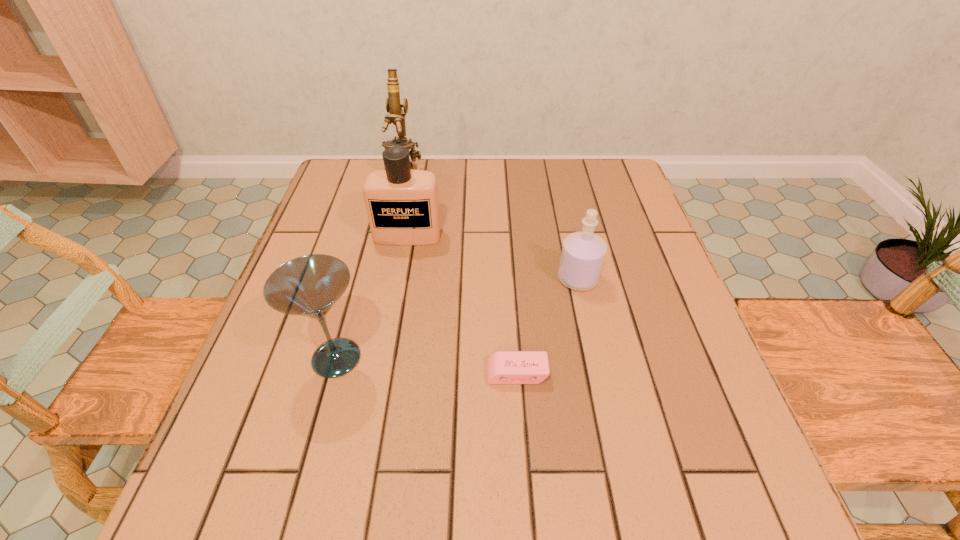
At what (x,y) coordinates should I click in order to perform the action: click on vacant space at the left edge. Please return your answer as a coordinate pair (x, y). This screenshot has height=540, width=960. Looking at the image, I should click on (302, 244).

Locate an element on the screen. vacant space at the right edge of the desktop is located at coordinates (731, 446).

Where is `vacant space at the far left corner of the desktop`? The height and width of the screenshot is (540, 960). vacant space at the far left corner of the desktop is located at coordinates (348, 195).

The width and height of the screenshot is (960, 540). I want to click on free space at the near left corner, so click(183, 514).

Image resolution: width=960 pixels, height=540 pixels. In the image, there is a desktop. What are the coordinates of `vacant region at the far right corner` in the screenshot? It's located at (578, 160).

At what (x,y) coordinates should I click in order to perform the action: click on free location at the near right corner of the desktop. Please return your answer as a coordinate pair (x, y). The height and width of the screenshot is (540, 960). Looking at the image, I should click on (697, 524).

Locate an element on the screen. This screenshot has width=960, height=540. free spot between the martini and the farther perfume is located at coordinates (372, 296).

Where is `vacant area between the martini and the farther perfume`? The height and width of the screenshot is (540, 960). vacant area between the martini and the farther perfume is located at coordinates (372, 296).

Where is `empty space that is in between the martini and the fourth object from left to right`? The image size is (960, 540). empty space that is in between the martini and the fourth object from left to right is located at coordinates (426, 366).

Image resolution: width=960 pixels, height=540 pixels. Find the location of `blank region between the left perfume and the martini`. blank region between the left perfume and the martini is located at coordinates (372, 296).